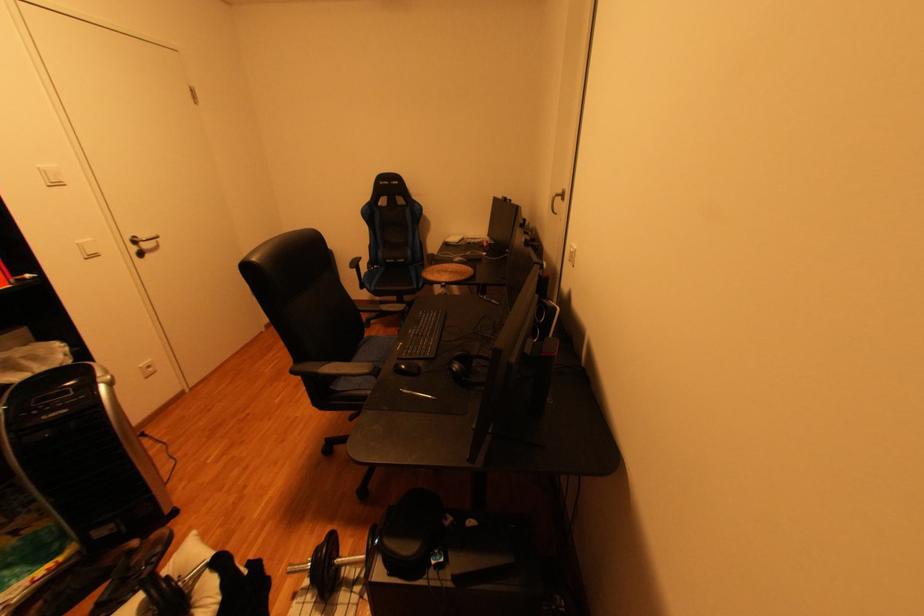
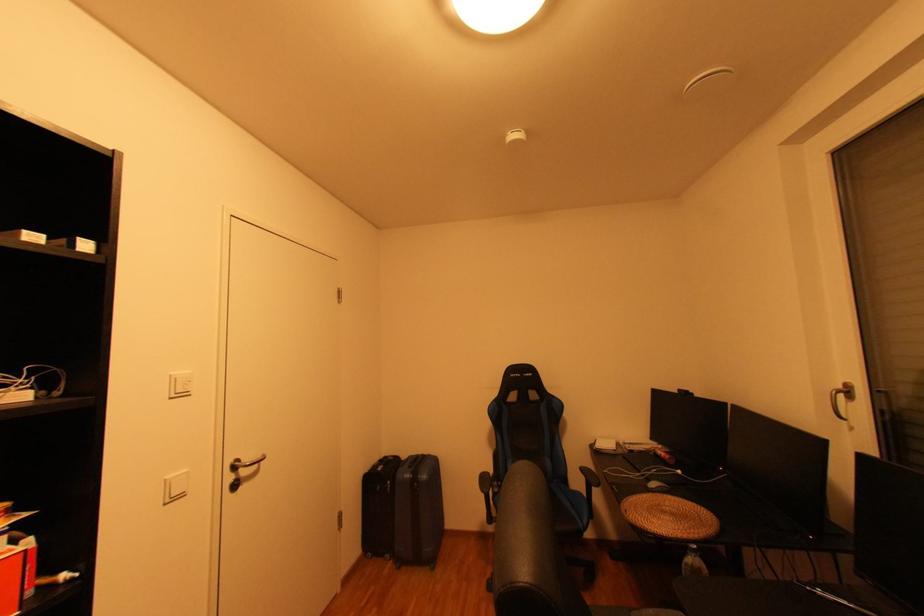
In the second image, find the point that corresponds to point 146,238 in the first image.

(247, 461)